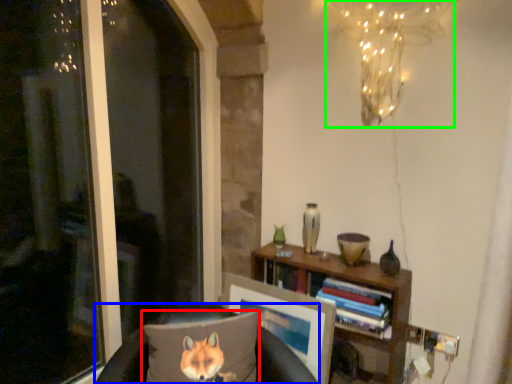
Question: Which object is positioned farthest from pillow (highlighted by a red box)? Select from furniture (highlighted by a blue box) and lamp (highlighted by a green box).

Choices:
 (A) furniture
 (B) lamp

Answer: (B)